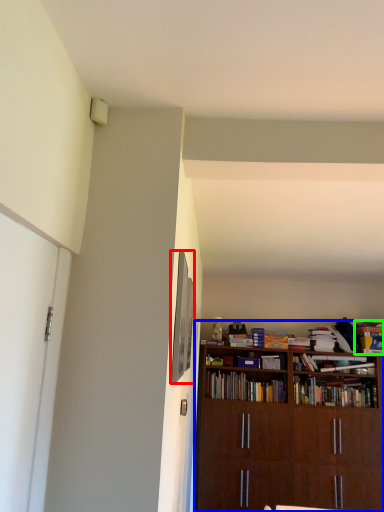
Question: Which object is the closest to the picture frame (highlighted by a red box)? Choose among these: bookcase (highlighted by a blue box) or book (highlighted by a green box).

Choices:
 (A) bookcase
 (B) book

Answer: (A)